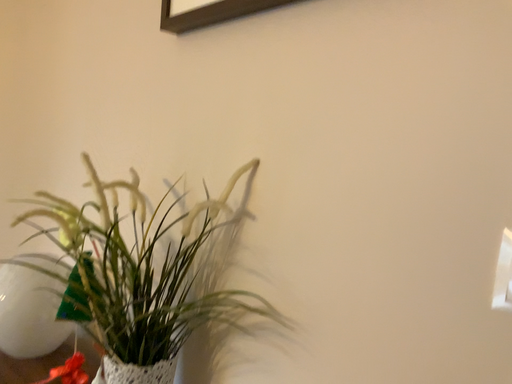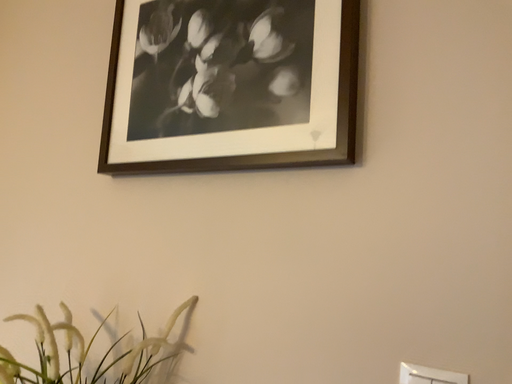
Question: Which way did the camera rotate in the video?

Choices:
 (A) rotated downward
 (B) rotated upward

Answer: (B)